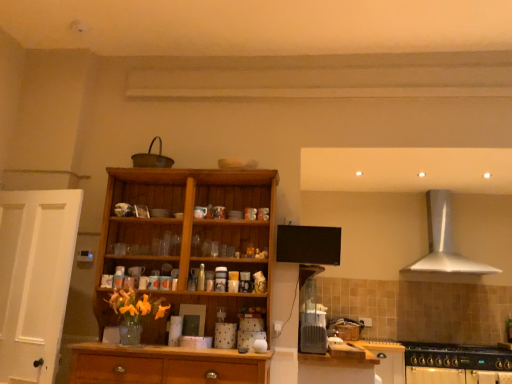
Identify the location of silver metallic range hood at upper right. (444, 242).

Measure the distance between black matte gas stove at lower right and camera.

black matte gas stove at lower right is 13.02 feet away from camera.

The width and height of the screenshot is (512, 384). What do you see at coordinates (457, 356) in the screenshot?
I see `black matte gas stove at lower right` at bounding box center [457, 356].

Find the location of a particular element. This screenshot has height=384, width=512. silver metallic range hood at upper right is located at coordinates (444, 242).

Which of these two, wooden cabinet at center or silver metallic range hood at upper right, is smaller?

With smaller size is silver metallic range hood at upper right.

Between wooden cabinet at center and silver metallic range hood at upper right, which one has more height?

Standing taller between the two is wooden cabinet at center.

Which is in front, point (138, 246) or point (440, 243)?

The point (138, 246) is closer.

Are wooden cabinet at center and silver metallic range hood at upper right far apart?

Yes, wooden cabinet at center and silver metallic range hood at upper right are quite far apart.

Looking at this image, considering the relative sizes of black matte gas stove at lower right and wooden cabinet at lower center, which is the second cabinetry from right to left, in the image provided, is black matte gas stove at lower right wider than wooden cabinet at lower center, which is the second cabinetry from right to left,?

Incorrect, the width of black matte gas stove at lower right does not surpass that of wooden cabinet at lower center, which is the second cabinetry from right to left.

Is black matte gas stove at lower right surrounding wooden cabinet at lower center, positioned as the 1th cabinetry in front-to-back order?

That's incorrect, wooden cabinet at lower center, positioned as the 1th cabinetry in front-to-back order, is not inside black matte gas stove at lower right.

Considering the sizes of black matte gas stove at lower right and wooden cabinet at lower center, which is the second cabinetry from right to left, in the image, is black matte gas stove at lower right bigger or smaller than wooden cabinet at lower center, which is the second cabinetry from right to left,?

In the image, black matte gas stove at lower right appears to be larger than wooden cabinet at lower center, which is the second cabinetry from right to left.

Is the position of black matte gas stove at lower right more distant than that of wooden cabinet at lower center, which is the second cabinetry from right to left?

Yes, the depth of black matte gas stove at lower right is greater than that of wooden cabinet at lower center, which is the second cabinetry from right to left.

Is silver metallic range hood at upper right taller or shorter than black matte gas stove at lower right?

silver metallic range hood at upper right is taller than black matte gas stove at lower right.

How many degrees apart are the facing directions of silver metallic range hood at upper right and black matte gas stove at lower right?

0.336 degrees separate the facing orientations of silver metallic range hood at upper right and black matte gas stove at lower right.

Is silver metallic range hood at upper right completely or partially outside of black matte gas stove at lower right?

Yes, silver metallic range hood at upper right is outside of black matte gas stove at lower right.

Based on the photo, from the image's perspective, is silver metallic range hood at upper right positioned above or below black matte gas stove at lower right?

Clearly, from the image's perspective, silver metallic range hood at upper right is above black matte gas stove at lower right.

Based on the photo, considering the relative sizes of white matte door at left and white matte cabinet at lower right, the first cabinetry positioned from the right, in the image provided, is white matte door at left taller than white matte cabinet at lower right, the first cabinetry positioned from the right,?

Yes.

Consider the image. From a real-world perspective, is white matte door at left over white matte cabinet at lower right, which is the 2th cabinetry from front to back?

Indeed, from a real-world perspective, white matte door at left stands above white matte cabinet at lower right, which is the 2th cabinetry from front to back.

Is white matte door at left far away from white matte cabinet at lower right, acting as the 2th cabinetry starting from the left?

Yes, white matte door at left and white matte cabinet at lower right, acting as the 2th cabinetry starting from the left, are located far from each other.

Can you confirm if black matte gas stove at lower right is positioned to the right of white matte door at left?

Yes, black matte gas stove at lower right is to the right of white matte door at left.

How different are the orientations of black matte gas stove at lower right and white matte door at left in degrees?

The angular difference between black matte gas stove at lower right and white matte door at left is 11.9 degrees.

Considering their positions, is black matte gas stove at lower right located in front of or behind white matte door at left?

Visually, black matte gas stove at lower right is located behind white matte door at left.

Between point (460, 262) and point (3, 262), which one is positioned in front?

The point (3, 262) is closer to the camera.

Based on the photo, from the image's perspective, which one is positioned higher, silver metallic range hood at upper right or white matte door at left?

silver metallic range hood at upper right appears higher in the image.

Considering the sizes of objects silver metallic range hood at upper right and white matte door at left in the image provided, who is thinner, silver metallic range hood at upper right or white matte door at left?

Thinner between the two is white matte door at left.

Is the position of silver metallic range hood at upper right more distant than that of white matte door at left?

Yes, silver metallic range hood at upper right is behind white matte door at left.

Considering the positions of point (387, 353) and point (317, 355), is point (387, 353) closer or farther from the camera than point (317, 355)?

Point (387, 353) is farther from the camera than point (317, 355).

You are a GUI agent. You are given a task and a screenshot of the screen. Output one action in this format:
    pyautogui.click(x=<x>, y=<y>)
    Task: Click on the cabinetry that is above the white matte cabinet at lower right, the first cabinetry positioned from the right (from the image's perspective)
    
    Given the screenshot: What is the action you would take?
    pyautogui.click(x=335, y=369)

Is white matte cabinet at lower right, the first cabinetry positioned from the right, facing towards wooden cabinet at lower center, the 1th cabinetry when ordered from left to right?

No, white matte cabinet at lower right, the first cabinetry positioned from the right, is not oriented towards wooden cabinet at lower center, the 1th cabinetry when ordered from left to right.

Is white matte cabinet at lower right, which is the 2th cabinetry from front to back, not close to wooden cabinet at lower center, the 2th cabinetry from the back?

They are positioned close to each other.

The width and height of the screenshot is (512, 384). Identify the location of cupboard on the left of silver metallic range hood at upper right. (188, 235).

Locate an element on the screen. The image size is (512, 384). gas stove that is below the wooden cabinet at lower center, positioned as the 1th cabinetry in front-to-back order (from the image's perspective) is located at coordinates (457, 356).

From the image, which object appears to be farther from white matte cabinet at lower right, which is the 2th cabinetry from front to back, white matte door at left or wooden cabinet at lower center, positioned as the 1th cabinetry in front-to-back order?

white matte door at left is positioned further to the anchor white matte cabinet at lower right, which is the 2th cabinetry from front to back.

Considering their positions, is white matte door at left positioned closer to silver metallic range hood at upper right than wooden cabinet at lower center, the 2th cabinetry from the back?

wooden cabinet at lower center, the 2th cabinetry from the back.

Estimate the real-world distances between objects in this image. Which object is further from black matte gas stove at lower right, silver metallic range hood at upper right or white matte door at left?

The object further to black matte gas stove at lower right is white matte door at left.

Which object lies nearer to the anchor point wooden cabinet at lower center, positioned as the 1th cabinetry in front-to-back order, wooden cabinet at center or silver metallic range hood at upper right?

Among the two, wooden cabinet at center is located nearer to wooden cabinet at lower center, positioned as the 1th cabinetry in front-to-back order.

Based on their spatial positions, is black matte gas stove at lower right or white matte door at left further from silver metallic range hood at upper right?

white matte door at left is further to silver metallic range hood at upper right.

Based on their spatial positions, is wooden cabinet at lower center, the 2th cabinetry from the back, or black matte gas stove at lower right further from wooden cabinet at center?

Among the two, black matte gas stove at lower right is located further to wooden cabinet at center.

When comparing their distances from wooden cabinet at lower center, which is the second cabinetry from right to left, does wooden cabinet at center or black matte gas stove at lower right seem closer?

black matte gas stove at lower right is closer to wooden cabinet at lower center, which is the second cabinetry from right to left.

From the image, which object appears to be nearer to white matte cabinet at lower right, acting as the 2th cabinetry starting from the left, wooden cabinet at lower center, positioned as the 1th cabinetry in front-to-back order, or wooden cabinet at center?

wooden cabinet at lower center, positioned as the 1th cabinetry in front-to-back order.

Locate an element on the screen. This screenshot has height=384, width=512. cabinetry situated between white matte door at left and white matte cabinet at lower right, the first cabinetry positioned from the right, from left to right is located at coordinates (335, 369).

You are a GUI agent. You are given a task and a screenshot of the screen. Output one action in this format:
    pyautogui.click(x=<x>, y=<y>)
    Task: Click on the gas stove between wooden cabinet at center and silver metallic range hood at upper right from left to right
    This screenshot has height=384, width=512.
    Given the screenshot: What is the action you would take?
    pyautogui.click(x=457, y=356)

Where is `cabinetry situated between wooden cabinet at center and white matte cabinet at lower right, which is the 2th cabinetry from front to back, from left to right`? cabinetry situated between wooden cabinet at center and white matte cabinet at lower right, which is the 2th cabinetry from front to back, from left to right is located at coordinates (335, 369).

I want to click on cupboard situated between white matte door at left and silver metallic range hood at upper right from left to right, so click(188, 235).